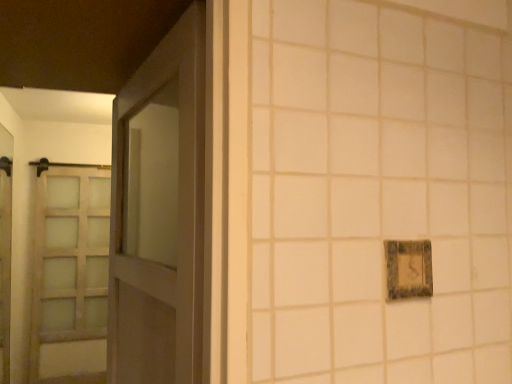
The width and height of the screenshot is (512, 384). What do you see at coordinates (159, 214) in the screenshot? I see `matte wood door at left` at bounding box center [159, 214].

What do you see at coordinates (409, 269) in the screenshot? I see `rustic stone picture frame at right` at bounding box center [409, 269].

Locate an element on the screen. This screenshot has height=384, width=512. matte glass elevator at left is located at coordinates (5, 249).

Which object is wider, satin wood barn door at left or rustic stone picture frame at right?

satin wood barn door at left is wider.

Based on their sizes in the image, would you say satin wood barn door at left is bigger or smaller than rustic stone picture frame at right?

In the image, satin wood barn door at left appears to be larger than rustic stone picture frame at right.

Between satin wood barn door at left and rustic stone picture frame at right, which one is positioned in front?

rustic stone picture frame at right.

Does satin wood barn door at left appear on the right side of rustic stone picture frame at right?

No.

Can you confirm if matte glass elevator at left is taller than matte wood door at left?

Yes, matte glass elevator at left is taller than matte wood door at left.

Can you confirm if matte glass elevator at left is positioned to the left of matte wood door at left?

Yes.

Based on the photo, from a real-world perspective, is matte glass elevator at left physically below matte wood door at left?

Indeed, from a real-world perspective, matte glass elevator at left is positioned beneath matte wood door at left.

From the image's perspective, is matte glass elevator at left below matte wood door at left?

Yes.

From the image's perspective, would you say rustic stone picture frame at right is shown under matte wood door at left?

No.

Considering the relative positions of rustic stone picture frame at right and matte wood door at left in the image provided, is rustic stone picture frame at right to the left or to the right of matte wood door at left?

From the image, it's evident that rustic stone picture frame at right is to the right of matte wood door at left.

How many degrees apart are the facing directions of rustic stone picture frame at right and matte wood door at left?

The angle between the facing direction of rustic stone picture frame at right and the facing direction of matte wood door at left is 82.4 degrees.

Which of these two, rustic stone picture frame at right or matte wood door at left, stands taller?

With more height is matte wood door at left.

Considering the relative sizes of rustic stone picture frame at right and satin wood barn door at left in the image provided, is rustic stone picture frame at right wider than satin wood barn door at left?

Incorrect, the width of rustic stone picture frame at right does not surpass that of satin wood barn door at left.

How much distance is there between rustic stone picture frame at right and satin wood barn door at left?

rustic stone picture frame at right and satin wood barn door at left are 3.85 meters apart.

From a real-world perspective, which object rests below the other?

satin wood barn door at left, from a real-world perspective.

Is rustic stone picture frame at right oriented towards satin wood barn door at left?

No, rustic stone picture frame at right is not facing towards satin wood barn door at left.

Considering the relative positions of matte wood door at left and satin wood barn door at left in the image provided, is matte wood door at left to the left of satin wood barn door at left from the viewer's perspective?

In fact, matte wood door at left is to the right of satin wood barn door at left.

Considering the sizes of objects matte wood door at left and satin wood barn door at left in the image provided, who is smaller, matte wood door at left or satin wood barn door at left?

matte wood door at left is smaller.

From a real-world perspective, is matte wood door at left below satin wood barn door at left?

No, from a real-world perspective, matte wood door at left is not under satin wood barn door at left.

At what (x,y) coordinates should I click in order to perform the action: click on door on the right of satin wood barn door at left. Please return your answer as a coordinate pair (x, y). The height and width of the screenshot is (384, 512). Looking at the image, I should click on (159, 214).

From a real-world perspective, is rustic stone picture frame at right positioned above or below matte glass elevator at left?

From a real-world perspective, rustic stone picture frame at right is physically above matte glass elevator at left.

Which object is wider, rustic stone picture frame at right or matte glass elevator at left?

With larger width is matte glass elevator at left.

How distant is rustic stone picture frame at right from matte glass elevator at left?

They are 13.04 feet apart.

From the image's perspective, relative to matte glass elevator at left, is rustic stone picture frame at right above or below?

Clearly, from the image's perspective, rustic stone picture frame at right is above matte glass elevator at left.

Does matte glass elevator at left have a greater width compared to satin wood barn door at left?

In fact, matte glass elevator at left might be narrower than satin wood barn door at left.

Which object is positioned more to the right, matte glass elevator at left or satin wood barn door at left?

Positioned to the right is satin wood barn door at left.

Find the location of a particular element. The width and height of the screenshot is (512, 384). barn door on the left of rustic stone picture frame at right is located at coordinates (69, 266).

I want to click on door that appears on the right of matte glass elevator at left, so click(159, 214).

Which object lies further to the anchor point rustic stone picture frame at right, matte wood door at left or satin wood barn door at left?

Based on the image, satin wood barn door at left appears to be further to rustic stone picture frame at right.

Looking at the image, which one is located further to matte glass elevator at left, satin wood barn door at left or matte wood door at left?

The object further to matte glass elevator at left is matte wood door at left.

Looking at this image, from the image, which object appears to be nearer to matte glass elevator at left, matte wood door at left or satin wood barn door at left?

satin wood barn door at left.

Based on their spatial positions, is satin wood barn door at left or rustic stone picture frame at right closer to matte glass elevator at left?

satin wood barn door at left is closer to matte glass elevator at left.

From the image, which object appears to be nearer to rustic stone picture frame at right, matte glass elevator at left or satin wood barn door at left?

satin wood barn door at left is positioned closer to the anchor rustic stone picture frame at right.

Based on their spatial positions, is matte glass elevator at left or rustic stone picture frame at right further from matte wood door at left?

Based on the image, matte glass elevator at left appears to be further to matte wood door at left.

Based on their spatial positions, is matte glass elevator at left or satin wood barn door at left closer to matte wood door at left?

satin wood barn door at left lies closer to matte wood door at left than the other object.

Estimate the real-world distances between objects in this image. Which object is further from rustic stone picture frame at right, satin wood barn door at left or matte wood door at left?

satin wood barn door at left.

Image resolution: width=512 pixels, height=384 pixels. In order to click on elevator between rustic stone picture frame at right and satin wood barn door at left along the z-axis in this screenshot , I will do `click(5, 249)`.

Locate an element on the screen. The width and height of the screenshot is (512, 384). picture frame located between matte wood door at left and satin wood barn door at left in the depth direction is located at coordinates (409, 269).

Find the location of `picture frame between matte wood door at left and matte glass elevator at left in the front-back direction`. picture frame between matte wood door at left and matte glass elevator at left in the front-back direction is located at coordinates (409, 269).

Locate an element on the screen. This screenshot has height=384, width=512. elevator located between matte wood door at left and satin wood barn door at left in the depth direction is located at coordinates (5, 249).